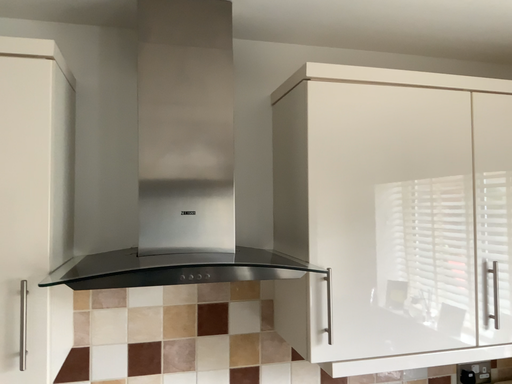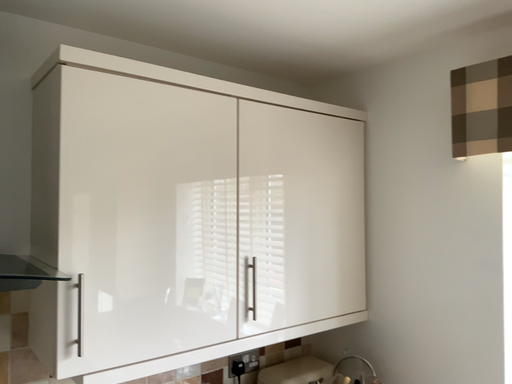
Question: Which way did the camera rotate in the video?

Choices:
 (A) rotated left
 (B) rotated right

Answer: (B)